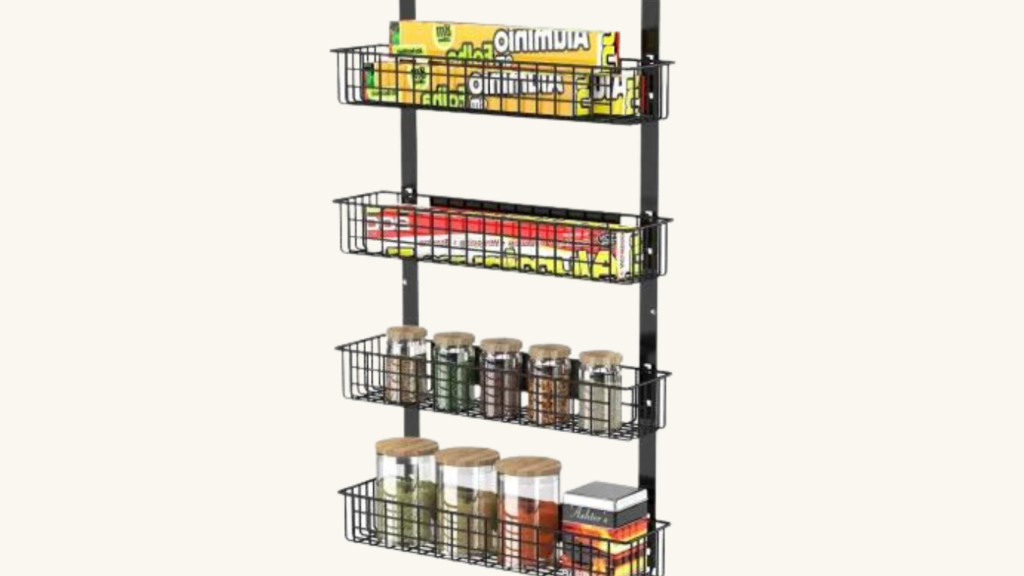
Locate an element on the screen. large jars of spices is located at coordinates (401, 492), (453, 487), (514, 502).